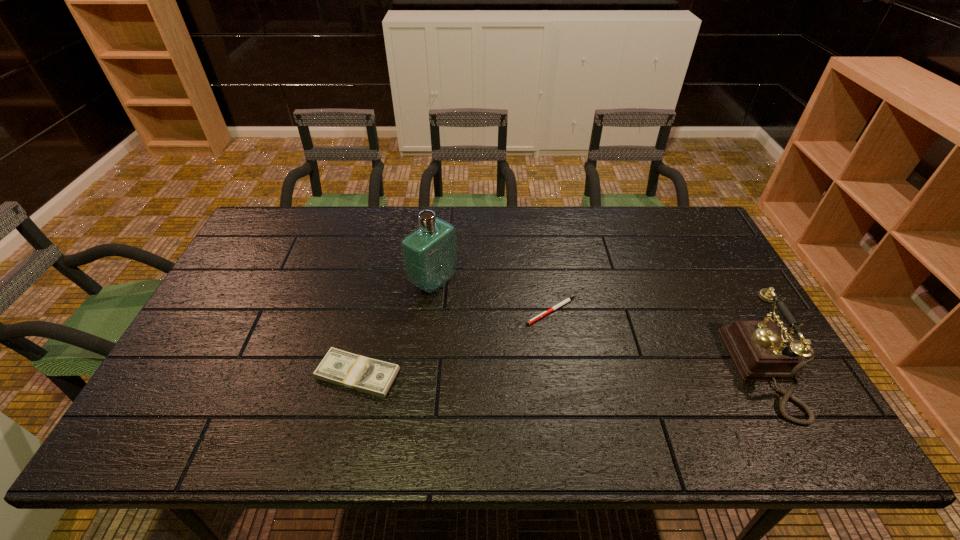
Identify the location of the third tallest object. pos(356,372).

The height and width of the screenshot is (540, 960). What are the coordinates of `the second tallest object` in the screenshot? It's located at (761, 352).

Image resolution: width=960 pixels, height=540 pixels. In order to click on telephone in this screenshot , I will do `click(761, 352)`.

I want to click on perfume, so click(x=429, y=253).

Find the location of `the shortest object`. the shortest object is located at coordinates (567, 300).

In order to click on the second object from right to left in this screenshot , I will do `click(567, 300)`.

Find the location of a particular element. free space located on the back of the third tallest object is located at coordinates (372, 312).

Identify the location of free space located on the front label of the perfume. Image resolution: width=960 pixels, height=540 pixels. 497,321.

Identify the location of vacant area located on the front label of the perfume. The image size is (960, 540). (494, 320).

Identify the location of vacant space positioned on the front label of the perfume. (472, 306).